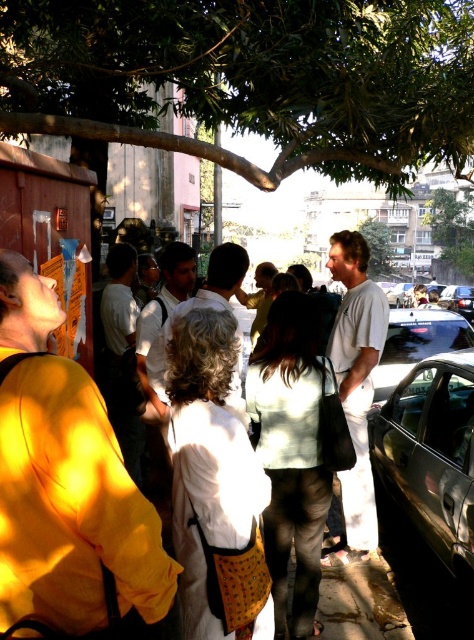
Is green leafy tree at upper center smaller than white cotton shirt at center?

No, green leafy tree at upper center is not smaller than white cotton shirt at center.

Describe the element at coordinates (251, 77) in the screenshot. I see `green leafy tree at upper center` at that location.

You are a GUI agent. You are given a task and a screenshot of the screen. Output one action in this format:
    pyautogui.click(x=<x>, y=<y>)
    Task: Click on the green leafy tree at upper center
    
    Given the screenshot: What is the action you would take?
    pyautogui.click(x=251, y=77)

Is white cotton shirt at center positioned behind green leafy tree at upper right?

That is False.

Which of these two, white cotton shirt at center or green leafy tree at upper right, stands shorter?

With less height is white cotton shirt at center.

Which is in front, point (348, 340) or point (430, 220)?

Positioned in front is point (348, 340).

Image resolution: width=474 pixels, height=640 pixels. Identify the location of white cotton shirt at center. (355, 385).

Which is more to the right, white cotton shirt at center or shiny black car at center?

From the viewer's perspective, shiny black car at center appears more on the right side.

Does white cotton shirt at center have a lesser width compared to shiny black car at center?

Yes.

Who is more forward, [376,339] or [434,326]?

Point [376,339] is in front.

Image resolution: width=474 pixels, height=640 pixels. In order to click on white cotton shirt at center in this screenshot , I will do `click(355, 385)`.